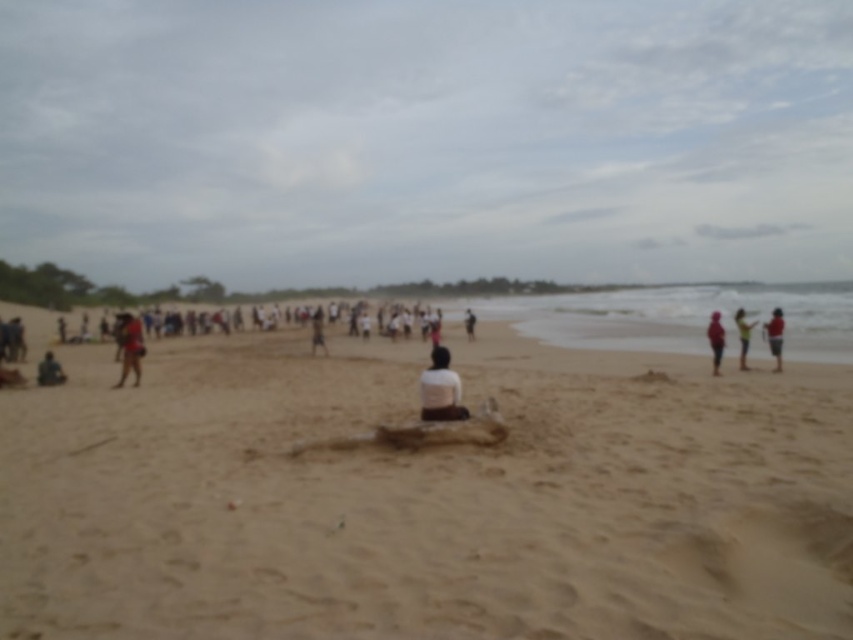
You are standing at the point marked by the coordinates point (131, 348). You want to walk towards the ocean. Which direction should you head?

Answer: The point (131, 348) marks the matte brown backpack at left. Since the beach scene has the ocean in the distance beyond the sandy terrain, you should head towards the right to reach the ocean.

You are a photographer trying to capture two shirts in the scene. The white matte shirt at center and the white cotton shirt at right. Which shirt should you focus on if you want to photograph the narrower one?

The white matte shirt at center is thinner than the white cotton shirt at right, so you should focus on the white matte shirt at center.

You are standing at the point labeled point (321, 323) on the beach. You want to walk to the point labeled point (428, 380). Which direction should you move relative to your current position?

You should move forward because point (428, 380) is in front of point (321, 323).